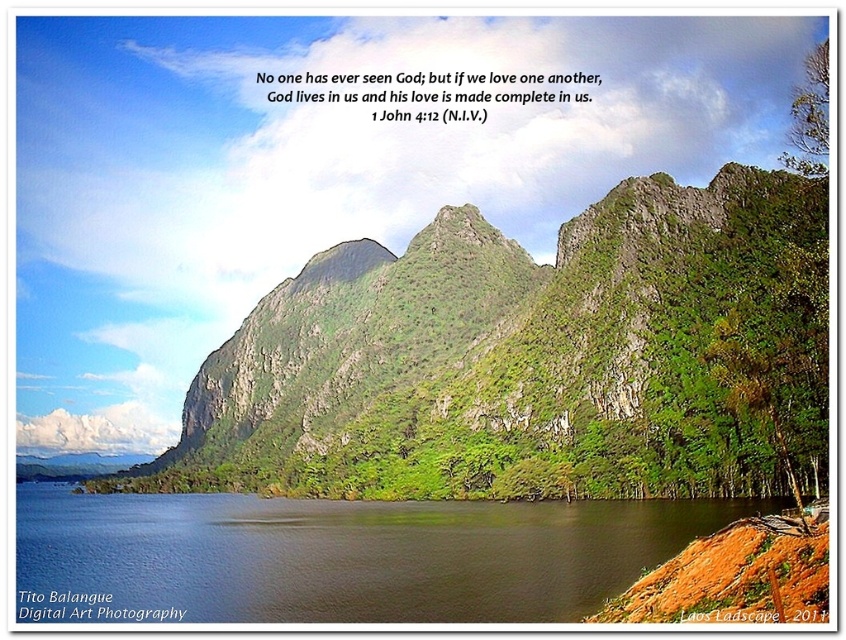
From the picture: You are a hiker planning to take a photo of the green rocky mountain at center from the water edge. Where should you position yourself to capture the mountain in the background with the water in the foreground?

The green rocky mountain at center is located at point (536, 358), so you should position yourself at the water edge facing towards the coordinates (536, 358) to capture the mountain in the background with the water in the foreground.

Based on the scene, what does the point at coordinates (536, 358) represent?

The point at coordinates (536, 358) corresponds to the green rocky mountain at center.

You are standing at the edge of the blue water at lower left and want to reach the green rocky mountain at center. Which direction should you head to get there?

To reach the green rocky mountain at center from the blue water at lower left, you should head to the right since the green rocky mountain at center is located to the right of the blue water at lower left.